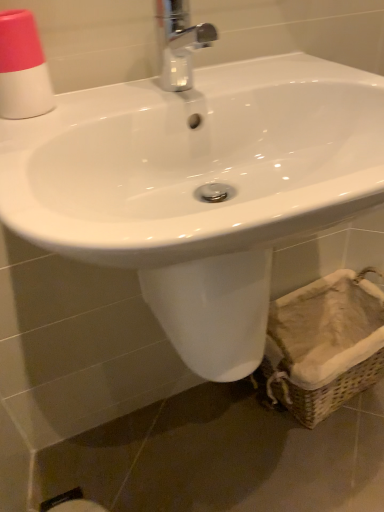
This screenshot has width=384, height=512. I want to click on empty space that is in between pink matte cup at upper left and chrome metallic faucet at upper center, so click(112, 104).